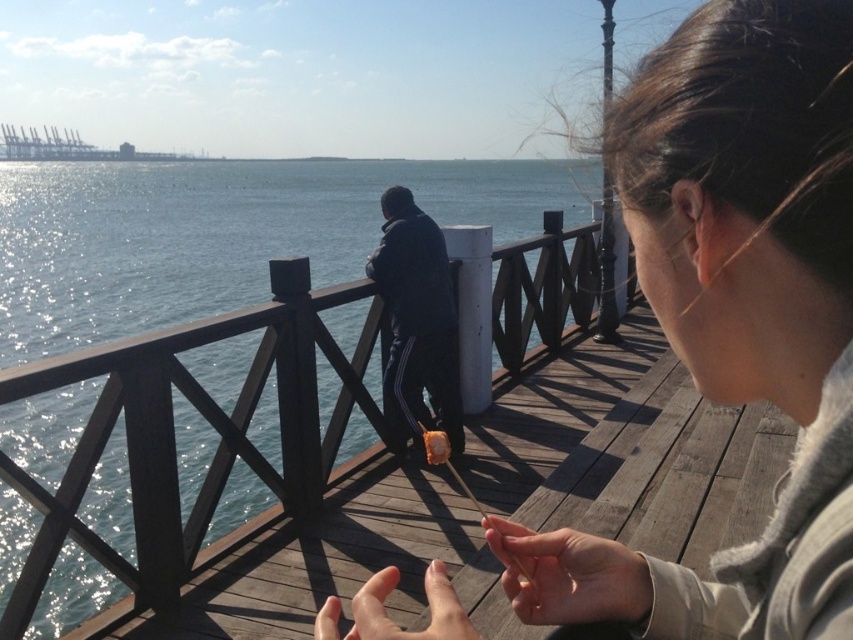
Does point (421, 332) lie in front of point (564, 563)?

No, (421, 332) is further to viewer.

Does point (456, 340) come behind point (554, 545)?

Yes, it is behind point (554, 545).

Where is `dark blue fabric jacket at center`? The width and height of the screenshot is (853, 640). dark blue fabric jacket at center is located at coordinates (416, 321).

Where is `dark blue fabric jacket at center`? dark blue fabric jacket at center is located at coordinates (416, 321).

Which is in front, point (537, 600) or point (428, 372)?

Point (537, 600) is more forward.

Is point (674, 131) in front of point (422, 272)?

Yes, it is.

I want to click on smooth beige sweater at center, so click(x=733, y=316).

Which of these two, dark blue fabric jacket at center or smooth skin hand at center, stands taller?

Standing taller between the two is dark blue fabric jacket at center.

Is point (439, 284) positioned in front of point (363, 612)?

No, (439, 284) is further to viewer.

In order to click on dark blue fabric jacket at center in this screenshot , I will do `click(416, 321)`.